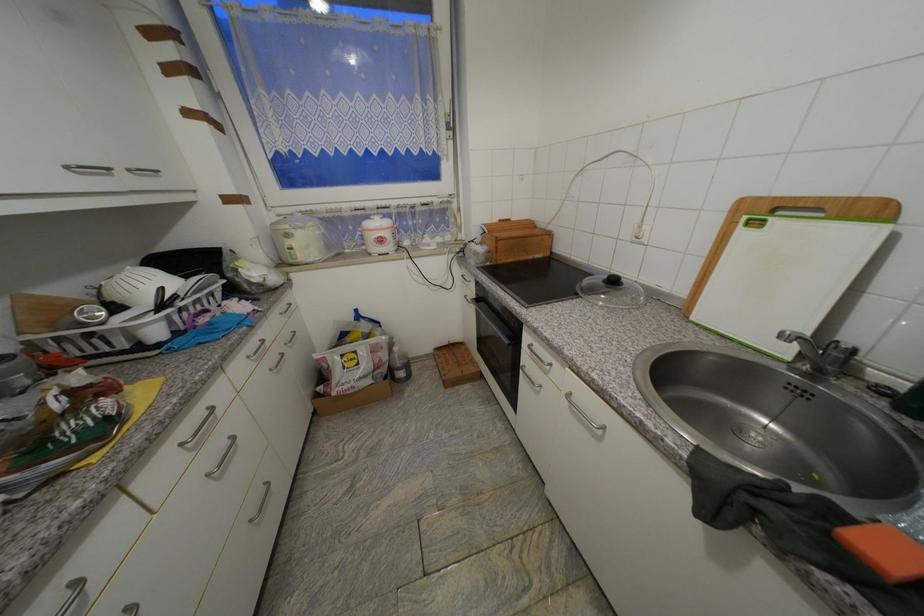
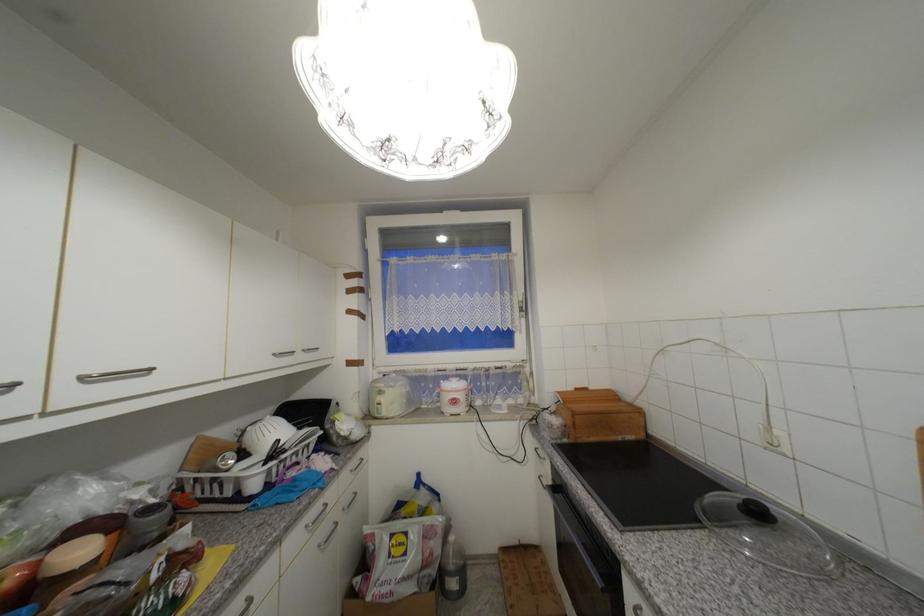
Find the pixel in the second image that matches (x=294, y=237) in the first image.

(386, 394)